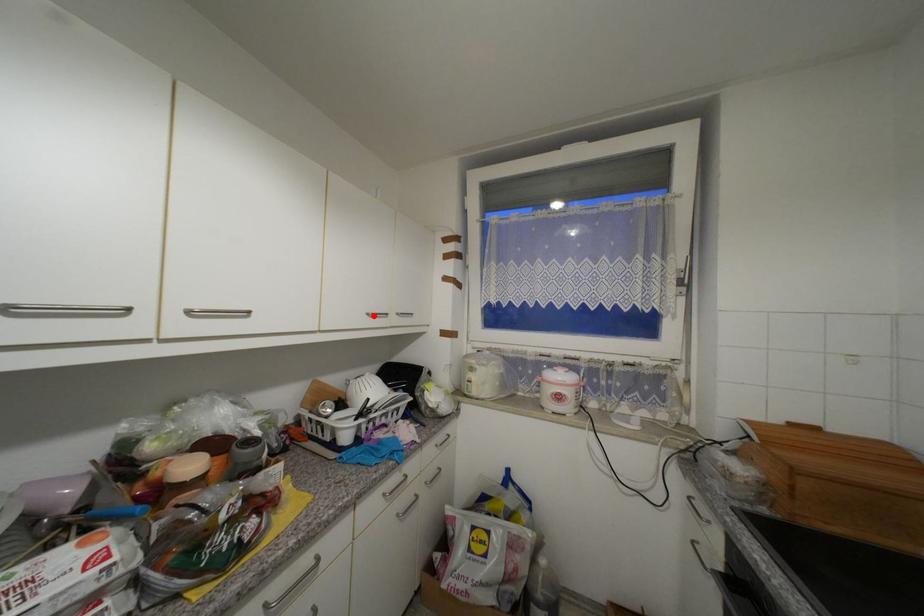
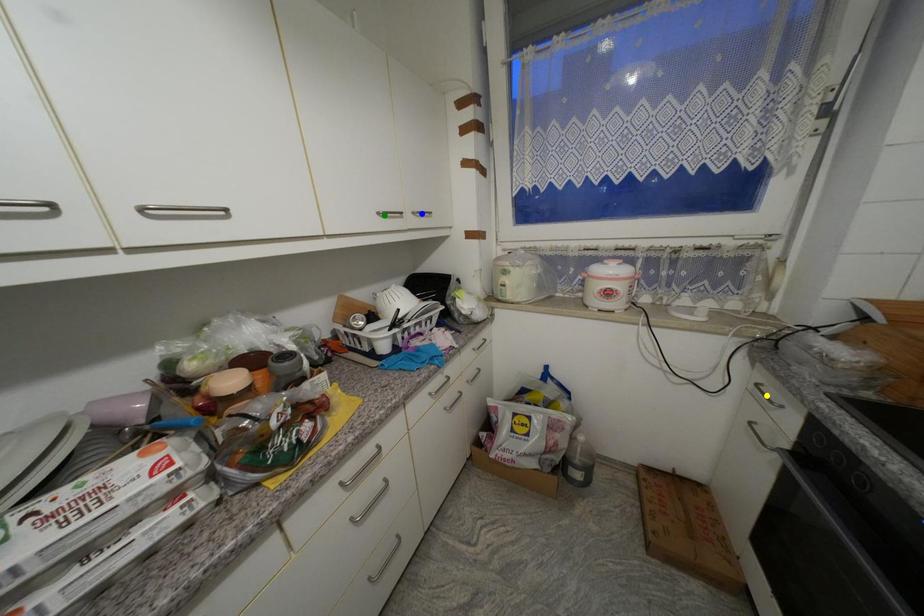
Question: I am providing you with two images of the same scene from different viewpoints. A red point is marked on the first image. You are given multiple points on the second image. Which point in image 2 represents the same 3d spot as the red point in image 1?

Choices:
 (A) yellow point
 (B) green point
 (C) blue point

Answer: (B)